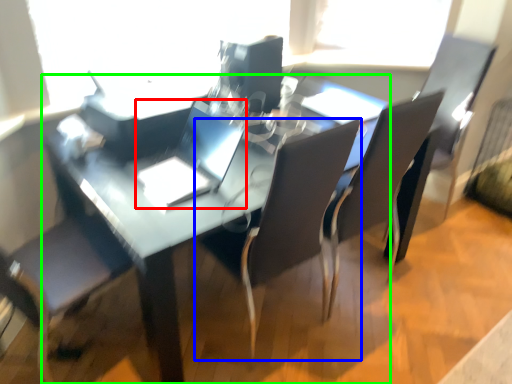
Question: Considering the real-world distances, which object is farthest from laptop (highlighted by a red box)? chair (highlighted by a blue box) or table (highlighted by a green box)?

Choices:
 (A) chair
 (B) table

Answer: (A)